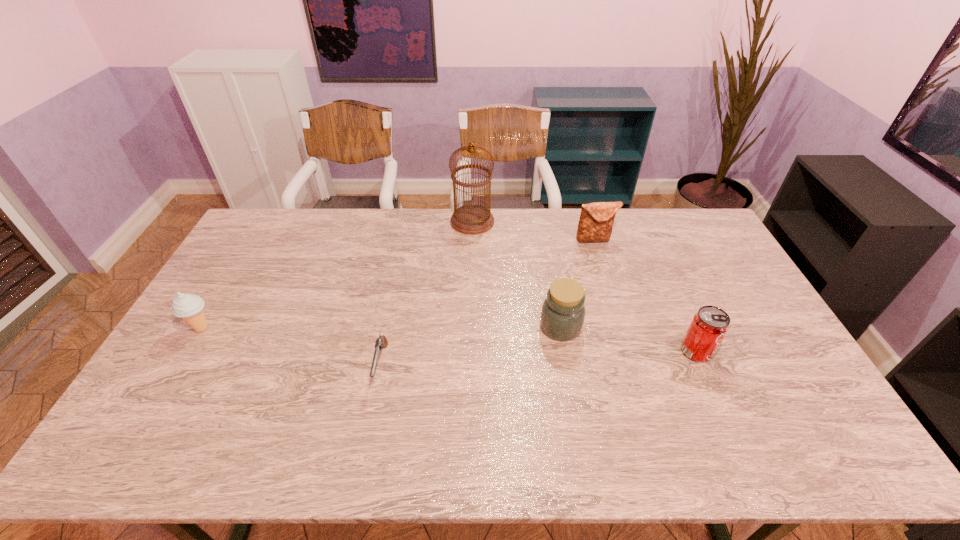
This screenshot has height=540, width=960. Identify the location of blank space at the far left corner of the desktop. (276, 215).

The height and width of the screenshot is (540, 960). I want to click on blank space at the far right corner of the desktop, so click(711, 239).

Identify the location of free space between the leftmost object and the fourth object from left to right. The image size is (960, 540). (381, 328).

The height and width of the screenshot is (540, 960). I want to click on unoccupied position between the shortest object and the jar, so click(470, 346).

Find the location of a particular element. blank region between the tallest object and the jar is located at coordinates (516, 274).

The height and width of the screenshot is (540, 960). Identify the location of vacant area that lies between the second object from right to left and the pop soda. pyautogui.click(x=645, y=295).

I want to click on vacant space in between the rightmost object and the leftmost object, so click(x=449, y=340).

At what (x,y) coordinates should I click in order to perform the action: click on empty location between the leftmost object and the fourth object from right to left. Please return your answer as a coordinate pair (x, y). The width and height of the screenshot is (960, 540). Looking at the image, I should click on (337, 275).

Find the location of `vacant space in between the fourth object from left to right and the rightmost object`. vacant space in between the fourth object from left to right and the rightmost object is located at coordinates (629, 339).

Where is `vacant space that is in between the pop soda and the jar`? This screenshot has width=960, height=540. vacant space that is in between the pop soda and the jar is located at coordinates (629, 339).